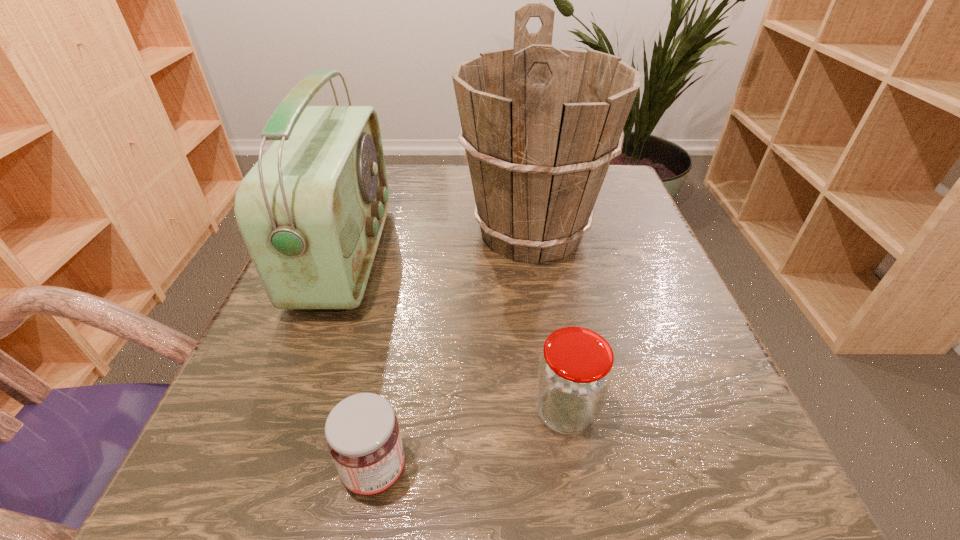
I want to click on bucket that is at the far edge, so click(540, 125).

The image size is (960, 540). I want to click on radio receiver positioned at the far edge, so click(311, 211).

Find the location of a particular element. This screenshot has width=960, height=540. object that is at the near edge is located at coordinates (363, 437).

Identify the location of object at the left edge. (311, 211).

This screenshot has height=540, width=960. I want to click on object positioned at the right edge, so click(x=540, y=125).

In order to click on object that is at the far left corner in this screenshot , I will do `click(311, 211)`.

The image size is (960, 540). Identify the location of object present at the far right corner. (540, 125).

You are a GUI agent. You are given a task and a screenshot of the screen. Output one action in this format:
    pyautogui.click(x=<x>, y=<y>)
    Task: Click on the vacant space at the far edge of the desktop
    
    Given the screenshot: What is the action you would take?
    pyautogui.click(x=398, y=193)

Image resolution: width=960 pixels, height=540 pixels. Find the location of `vacant space at the near edge`. vacant space at the near edge is located at coordinates (577, 474).

Identify the location of free spot at the left edge of the desktop. This screenshot has height=540, width=960. (368, 283).